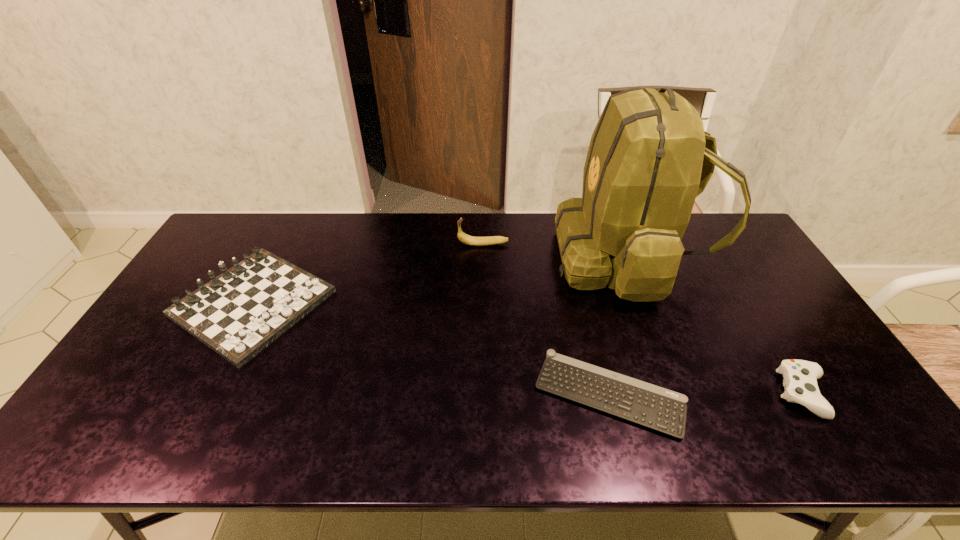
Where is `backpack`? This screenshot has width=960, height=540. backpack is located at coordinates (649, 157).

Locate an element on the screen. The height and width of the screenshot is (540, 960). the fourth shortest object is located at coordinates (464, 238).

Locate an element on the screen. The height and width of the screenshot is (540, 960). the fourth object from right to left is located at coordinates (464, 238).

The width and height of the screenshot is (960, 540). I want to click on the third shortest object, so click(x=239, y=313).

At what (x,y) coordinates should I click in order to perform the action: click on the leftmost object. Please return your answer as a coordinate pair (x, y). Image resolution: width=960 pixels, height=540 pixels. Looking at the image, I should click on (239, 313).

This screenshot has width=960, height=540. Identify the location of the second shortest object. (800, 377).

At what (x,y) coordinates should I click in order to perform the action: click on the shortest object. Please return your answer as a coordinate pair (x, y). This screenshot has height=540, width=960. Looking at the image, I should click on (651, 406).

The height and width of the screenshot is (540, 960). In order to click on free location located 0.330m on the front-facing side of the tallest object in this screenshot , I will do `click(457, 257)`.

Where is `free space located on the front-facing side of the tallest object`? The height and width of the screenshot is (540, 960). free space located on the front-facing side of the tallest object is located at coordinates (439, 257).

Identify the location of free space located 0.090m on the front-facing side of the tallest object. (528, 257).